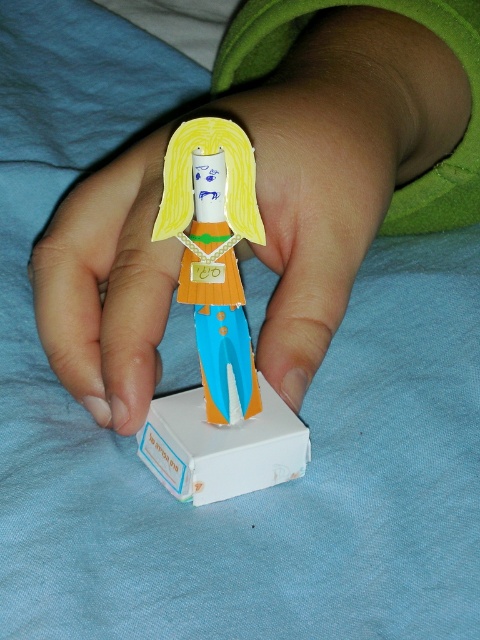
You are a child who wants to place both the matte paper doll at center and the cardboard doll at center into a small gift box. Which doll should you put first to ensure both fit inside?

The matte paper doll at center is bigger than the cardboard doll at center, so you should place the bigger matte paper doll at center first to ensure both fit inside the small gift box.

What is located at the coordinates point [340,160] in the image?

The point [340,160] is where the matte paper doll at center is located.

Where is the cardboard doll at center positioned in the image?

The cardboard doll at center is located at point coordinates of (217,328).